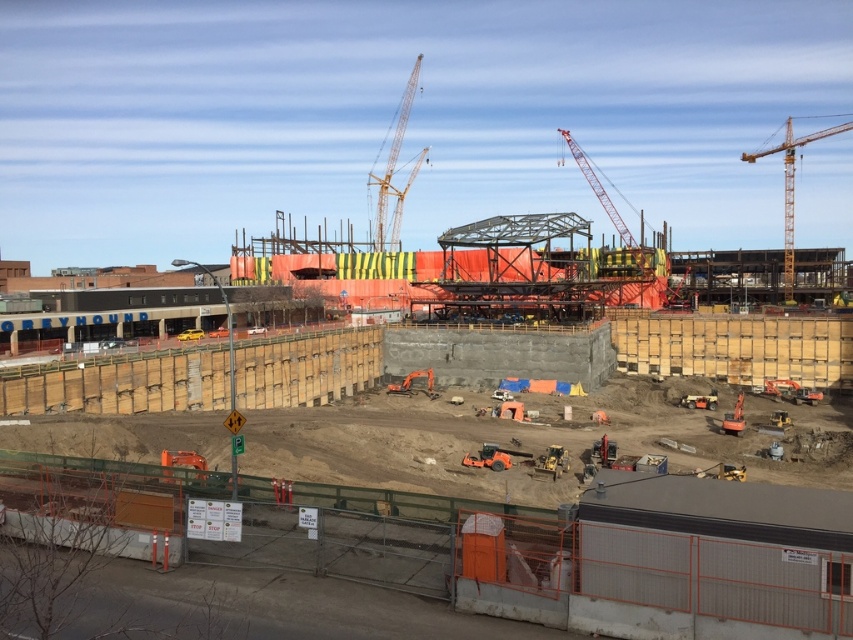
Question: Can you confirm if concrete wall at center is positioned to the left of yellow metallic crane at upper center?

Choices:
 (A) yes
 (B) no

Answer: (B)

Question: Estimate the real-world distances between objects in this image. Which object is closer to the yellow metallic crane at upper center?

Choices:
 (A) yellow metallic crane at upper right
 (B) concrete wall at center

Answer: (A)

Question: Which point appears closest to the camera in this image?

Choices:
 (A) (780, 148)
 (B) (374, 236)

Answer: (B)

Question: Can you confirm if concrete wall at center is bigger than yellow metallic crane at upper right?

Choices:
 (A) yes
 (B) no

Answer: (B)

Question: Is concrete wall at center bigger than yellow metallic crane at upper center?

Choices:
 (A) yes
 (B) no

Answer: (B)

Question: Which object appears farthest from the camera in this image?

Choices:
 (A) yellow metallic crane at upper right
 (B) yellow metallic crane at upper center
 (C) concrete wall at center

Answer: (B)